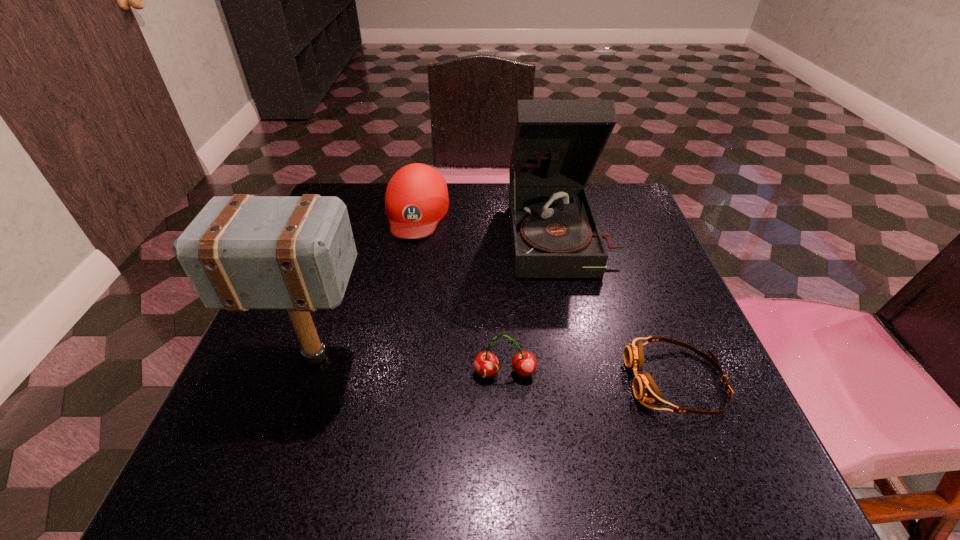
At what (x,y) coordinates should I click in order to perform the action: click on vacant space in between the mallet and the baseball cap. Please return your answer as a coordinate pair (x, y). The image size is (960, 540). Looking at the image, I should click on (366, 284).

You are a GUI agent. You are given a task and a screenshot of the screen. Output one action in this format:
    pyautogui.click(x=<x>, y=<y>)
    Task: Click on the free space that is in between the cherry and the baseball cap
    The image size is (960, 540).
    Given the screenshot: What is the action you would take?
    pyautogui.click(x=461, y=292)

Locate an element on the screen. The height and width of the screenshot is (540, 960). vacant area that lies between the cherry and the mallet is located at coordinates (410, 365).

Where is `the second closest object to the baseball cap`? the second closest object to the baseball cap is located at coordinates (243, 252).

Locate an element on the screen. This screenshot has height=540, width=960. the third closest object to the phonograph_record is located at coordinates (524, 363).

The height and width of the screenshot is (540, 960). In order to click on free space that satisfies the following two spatial constraints: 1. on the front-facing side of the phonograph_record; 2. on the striking surface of the mallet in this screenshot , I will do `click(588, 357)`.

The width and height of the screenshot is (960, 540). What are the coordinates of `free space that satisfies the following two spatial constraints: 1. on the front-facing side of the baseball cap; 2. on the striking surface of the mallet` in the screenshot? It's located at (389, 357).

This screenshot has height=540, width=960. What are the coordinates of `free location that satisfies the following two spatial constraints: 1. on the front-facing side of the phonograph_record; 2. on the striking surface of the mallet` in the screenshot? It's located at (588, 357).